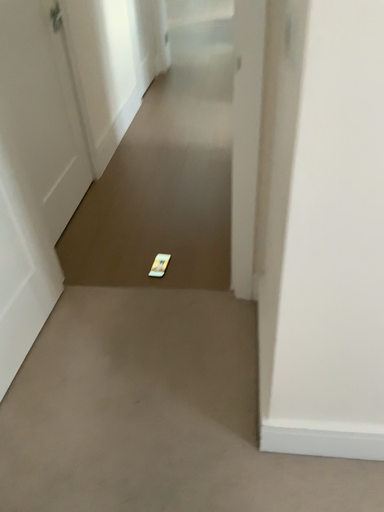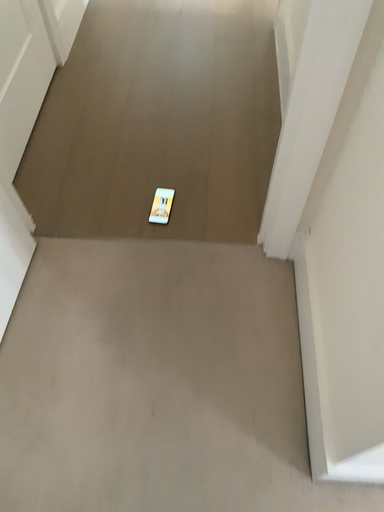
Question: Which way did the camera rotate in the video?

Choices:
 (A) rotated upward
 (B) rotated downward

Answer: (B)